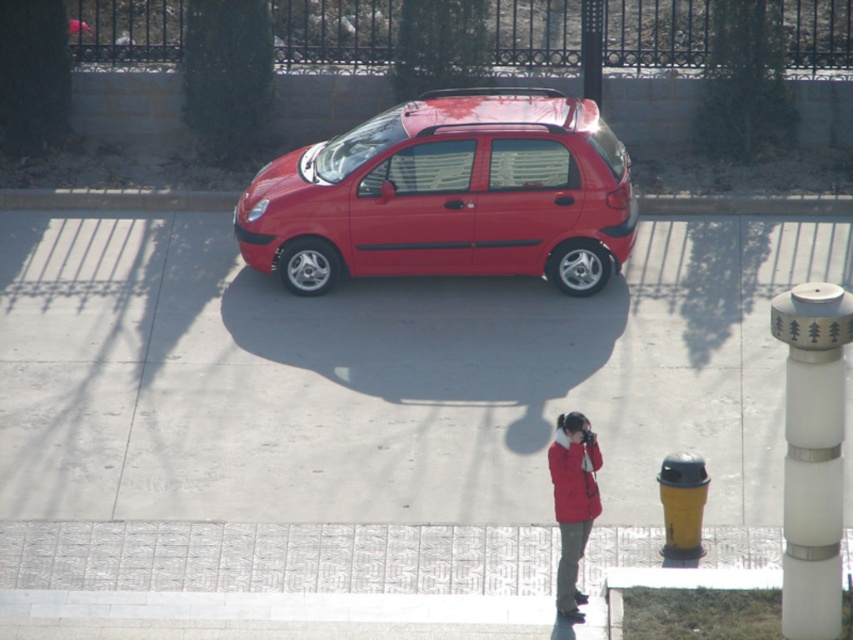
Question: Which of the following is the closest to the observer?

Choices:
 (A) smooth concrete curb at center
 (B) smooth concrete pavement at center
 (C) red matte jacket at lower center
 (D) glossy red car at center

Answer: (C)

Question: Can you confirm if smooth concrete curb at center is positioned to the left of red matte jacket at lower center?

Choices:
 (A) no
 (B) yes

Answer: (B)

Question: Estimate the real-world distances between objects in this image. Which object is farther from the smooth concrete curb at center?

Choices:
 (A) glossy red car at center
 (B) red matte jacket at lower center

Answer: (B)

Question: Does smooth concrete pavement at center appear over glossy red car at center?

Choices:
 (A) yes
 (B) no

Answer: (B)

Question: Which point is farther to the camera?

Choices:
 (A) smooth concrete pavement at center
 (B) glossy red car at center
 (C) smooth concrete curb at center
 (D) red matte jacket at lower center

Answer: (C)

Question: Is smooth concrete curb at center to the right of red matte jacket at lower center from the viewer's perspective?

Choices:
 (A) yes
 (B) no

Answer: (B)